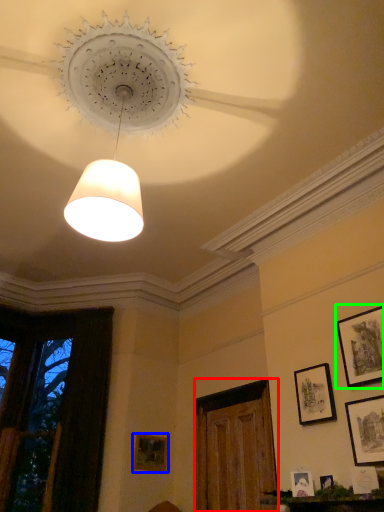
Question: Which is nearer to the glass door (highlighted by a red box)? picture frame (highlighted by a blue box) or picture frame (highlighted by a green box).

Choices:
 (A) picture frame
 (B) picture frame

Answer: (A)